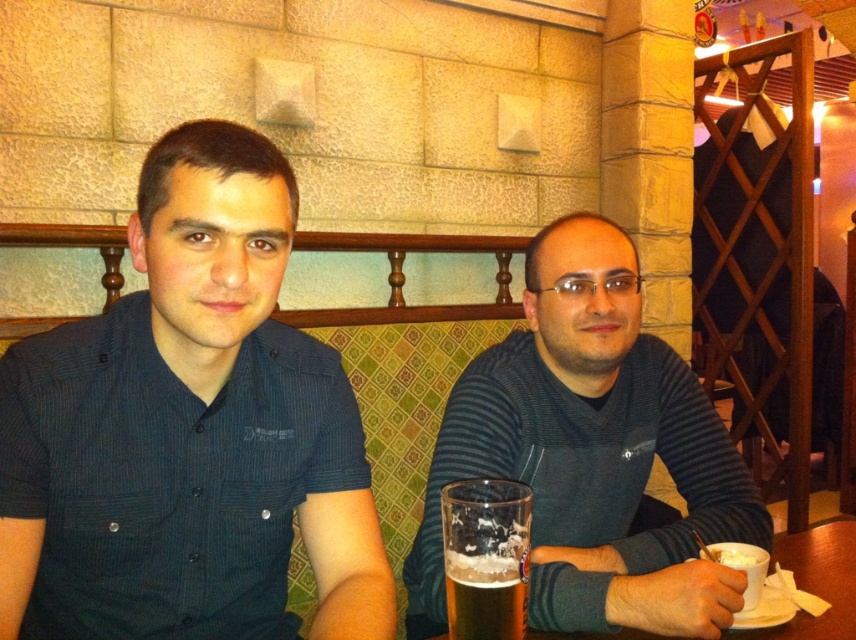
Who is positioned more to the right, foamy golden beer at lower center or foamy glass beer at lower center?

From the viewer's perspective, foamy glass beer at lower center appears more on the right side.

Can you confirm if foamy golden beer at lower center is positioned above foamy glass beer at lower center?

Correct, foamy golden beer at lower center is located above foamy glass beer at lower center.

Locate an element on the screen. foamy golden beer at lower center is located at coordinates (485, 557).

Between foamy golden beer at lower center and wooden table at lower center, which one is positioned lower?

wooden table at lower center is below.

Is foamy golden beer at lower center wider than wooden table at lower center?

No, foamy golden beer at lower center is not wider than wooden table at lower center.

Between point (496, 595) and point (831, 550), which one is positioned behind?

The point (831, 550) is behind.

Identify the location of foamy golden beer at lower center. The height and width of the screenshot is (640, 856). (485, 557).

What are the coordinates of `wooden table at lower center` in the screenshot? It's located at (816, 580).

The height and width of the screenshot is (640, 856). Describe the element at coordinates (816, 580) in the screenshot. I see `wooden table at lower center` at that location.

Measure the distance between point (817, 522) and camera.

Point (817, 522) and camera are 10.27 feet apart.

You are a GUI agent. You are given a task and a screenshot of the screen. Output one action in this format:
    pyautogui.click(x=<x>, y=<y>)
    Task: Click on the wooden table at lower center
    The image size is (856, 640).
    Given the screenshot: What is the action you would take?
    pyautogui.click(x=816, y=580)